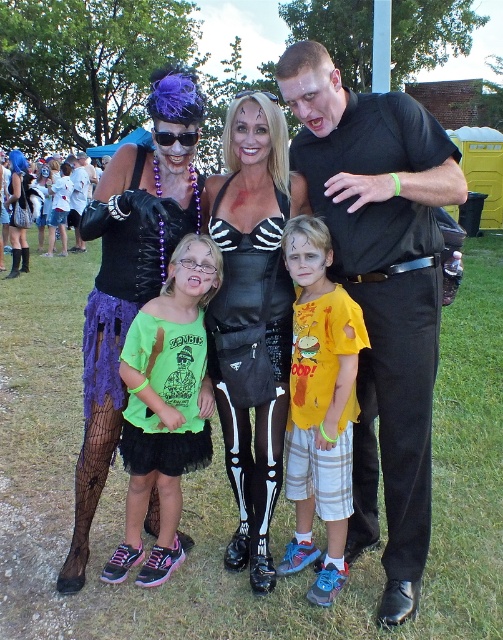
Is yellow cotton shirt at center to the right of matte purple wig at upper left from the viewer's perspective?

Correct, you'll find yellow cotton shirt at center to the right of matte purple wig at upper left.

Who is higher up, yellow cotton shirt at center or matte purple wig at upper left?

matte purple wig at upper left is above.

At what (x,y) coordinates should I click in order to perform the action: click on yellow cotton shirt at center. Please return your answer as a coordinate pair (x, y). Looking at the image, I should click on (319, 404).

What are the coordinates of `yellow cotton shirt at center` in the screenshot? It's located at (319, 404).

Based on the photo, who is positioned more to the left, black leather dress at center or matte black lace gloves at upper left?

From the viewer's perspective, matte black lace gloves at upper left appears more on the left side.

Does black leather dress at center have a smaller size compared to matte black lace gloves at upper left?

Correct, black leather dress at center occupies less space than matte black lace gloves at upper left.

Who is more distant from viewer, (261, 160) or (115, 195)?

The point (115, 195) is more distant.

At what (x,y) coordinates should I click in order to perform the action: click on black leather dress at center. Please return your answer as a coordinate pair (x, y). The width and height of the screenshot is (503, 640). Looking at the image, I should click on (253, 317).

Does black leather dress at center appear under yellow cotton shirt at center?

Incorrect, black leather dress at center is not positioned below yellow cotton shirt at center.

Between black leather dress at center and yellow cotton shirt at center, which one appears on the left side from the viewer's perspective?

From the viewer's perspective, black leather dress at center appears more on the left side.

Which is in front, point (293, 200) or point (341, 497)?

Point (341, 497) is more forward.

The height and width of the screenshot is (640, 503). Identify the location of black leather dress at center. (253, 317).